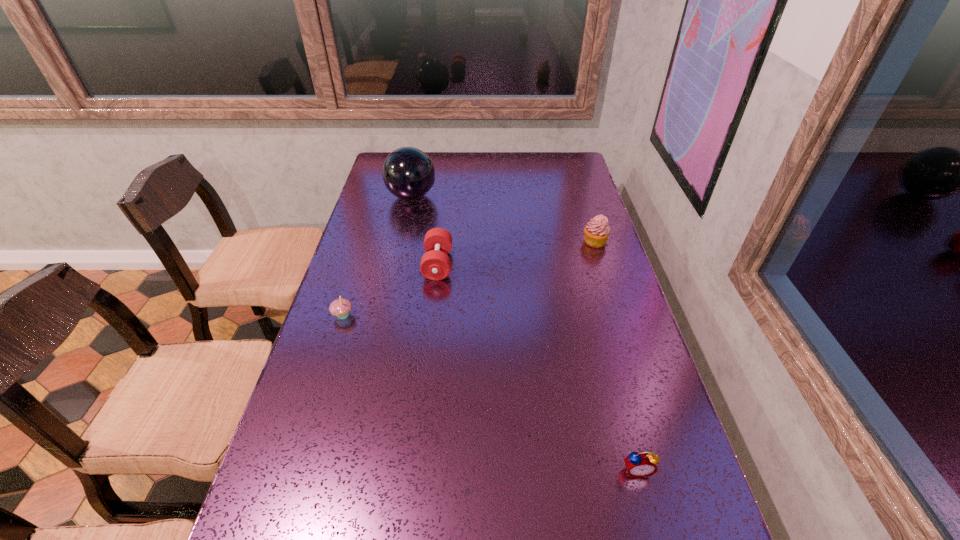
Where is `free point located on the front of the dumbbell`? free point located on the front of the dumbbell is located at coordinates (422, 401).

The width and height of the screenshot is (960, 540). I want to click on blank space located on the back of the nearer cupcake, so click(x=361, y=259).

Identify the location of free location located on the front-facing side of the alarm clock. This screenshot has width=960, height=540. (649, 516).

This screenshot has width=960, height=540. What are the coordinates of `bowling ball present at the left edge` in the screenshot? It's located at (408, 173).

At what (x,y) coordinates should I click in order to perform the action: click on cupcake present at the left edge. Please return your answer as a coordinate pair (x, y). The width and height of the screenshot is (960, 540). Looking at the image, I should click on (341, 307).

The height and width of the screenshot is (540, 960). Identify the location of cupcake that is at the right edge. (597, 231).

In order to click on alarm clock that is at the right edge in this screenshot , I will do `click(641, 464)`.

I want to click on free space at the far edge, so click(444, 152).

The width and height of the screenshot is (960, 540). I want to click on vacant space at the left edge of the desktop, so point(332,319).

Where is `vacant space at the right edge of the desktop`? vacant space at the right edge of the desktop is located at coordinates (612, 381).